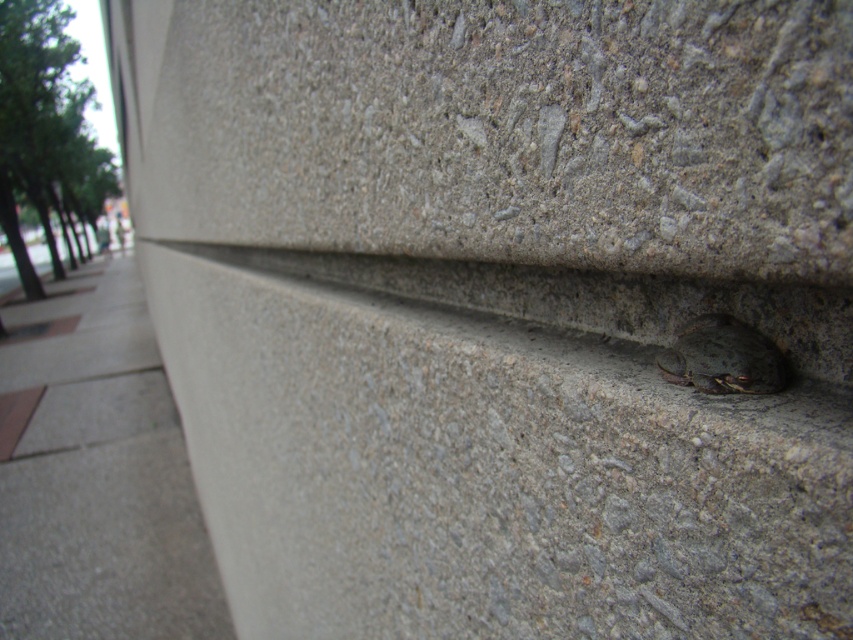
Question: Does gray concrete wall at lower right appear over gray concrete pavement at lower left?

Choices:
 (A) no
 (B) yes

Answer: (B)

Question: Can you confirm if gray concrete wall at lower right is positioned to the right of gray concrete pavement at lower left?

Choices:
 (A) no
 (B) yes

Answer: (B)

Question: Is gray concrete wall at lower right positioned before gray concrete pavement at lower left?

Choices:
 (A) no
 (B) yes

Answer: (B)